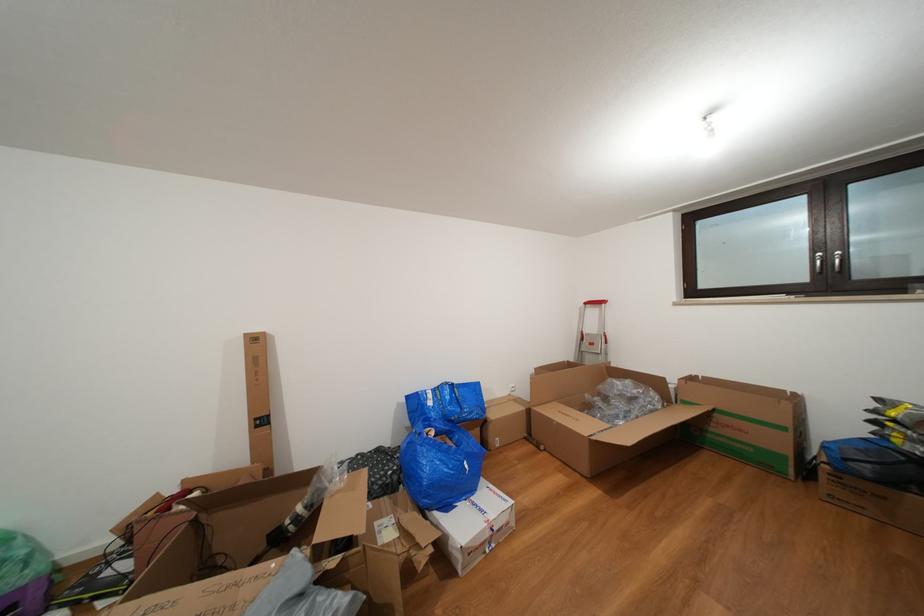
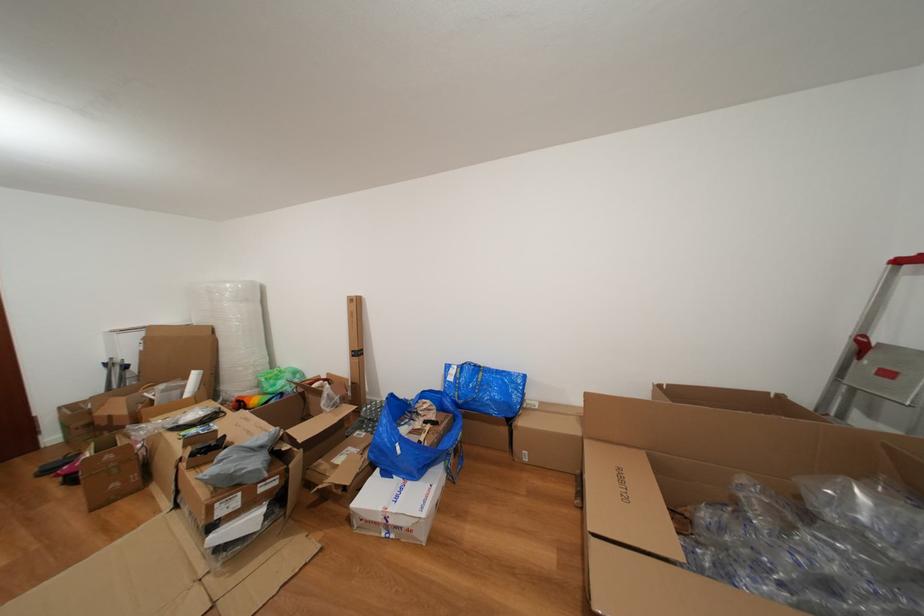
The point at (439, 408) is marked in the first image. Where is the corresponding point in the second image?

(458, 384)